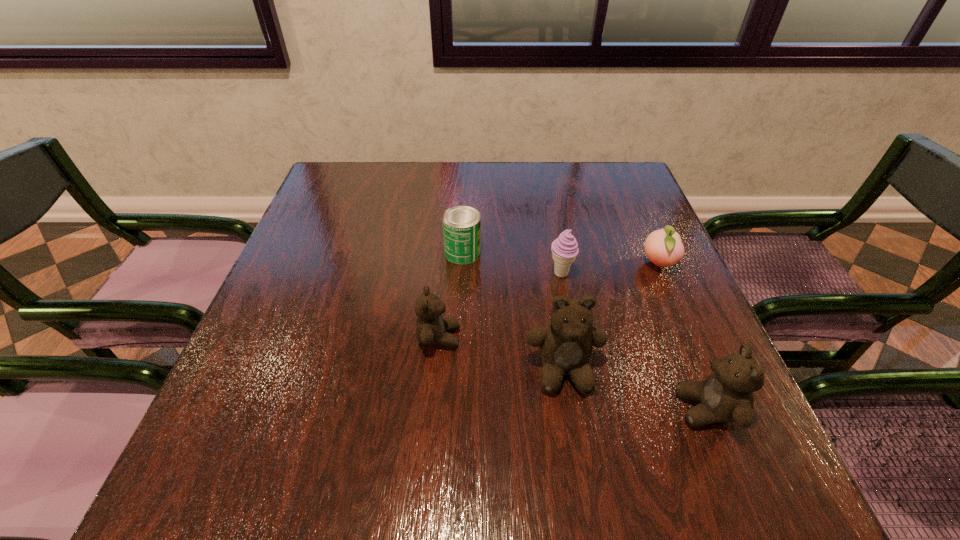
Where is `free space at the left edge of the desktop`? Image resolution: width=960 pixels, height=540 pixels. free space at the left edge of the desktop is located at coordinates (316, 260).

The width and height of the screenshot is (960, 540). What are the coordinates of `free space at the right edge of the desktop` in the screenshot? It's located at (634, 238).

Find the location of a particular element. The height and width of the screenshot is (540, 960). vacant area at the far left corner is located at coordinates (380, 163).

Where is `unoccupied position between the second teddy bear from right to left and the fifth shortest object`? unoccupied position between the second teddy bear from right to left and the fifth shortest object is located at coordinates (636, 390).

The width and height of the screenshot is (960, 540). I want to click on free space between the icecream and the peach, so click(x=610, y=269).

The image size is (960, 540). I want to click on vacant space that's between the peach and the rightmost teddy bear, so click(x=683, y=336).

The width and height of the screenshot is (960, 540). I want to click on unoccupied area between the second teddy bear from left to right and the peach, so click(611, 318).

You are a GUI agent. You are given a task and a screenshot of the screen. Output one action in this format:
    pyautogui.click(x=<x>, y=<y>)
    Task: Click on the free space between the fifth shortest object and the icecream
    
    Given the screenshot: What is the action you would take?
    pyautogui.click(x=634, y=341)

Where is `object that is the third closest to the peach`? The image size is (960, 540). object that is the third closest to the peach is located at coordinates (726, 395).

Locate which object is the second closest to the can. Please provide its 2D coordinates. Your answer should be formatted as a tuple, i.e. [(x, y)], where the tuple contains the x and y coordinates of a point satisfying the conditions above.

[(431, 328)]